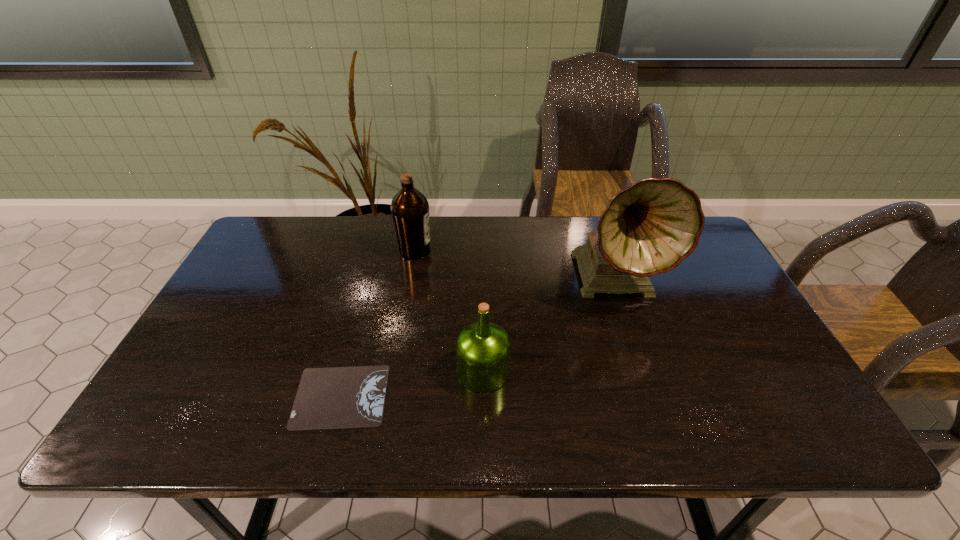
Locate which object ranks in proximity to the tallest object. Please provide its 2D coordinates. Your answer should be formatted as a tuple, i.e. [(x, y)], where the tuple contains the x and y coordinates of a point satisfying the conditions above.

[(483, 349)]

Locate an element on the screen. The height and width of the screenshot is (540, 960). vacant area in the image that satisfies the following two spatial constraints: 1. on the back side of the shortest object; 2. on the left side of the third object from left to right is located at coordinates (348, 371).

Find the location of a particular element. The width and height of the screenshot is (960, 540). free location that satisfies the following two spatial constraints: 1. on the label of the right olive oil; 2. on the right side of the left olive oil is located at coordinates (395, 371).

Identify the location of free location that satisfies the following two spatial constraints: 1. on the label of the taller olive oil; 2. on the front side of the shortest object. (390, 396).